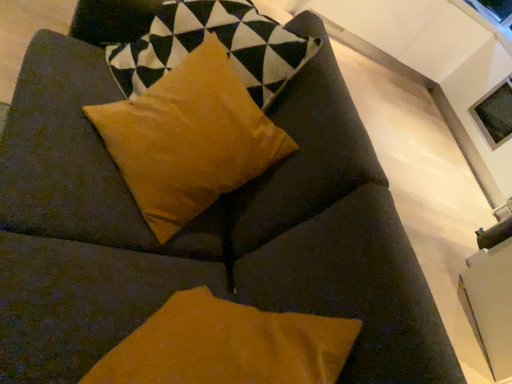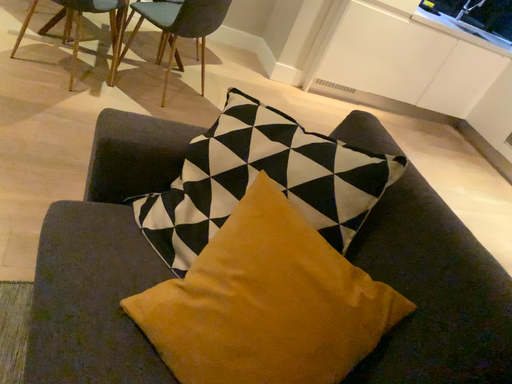
Question: How did the camera likely rotate when shooting the video?

Choices:
 (A) rotated downward
 (B) rotated upward

Answer: (B)